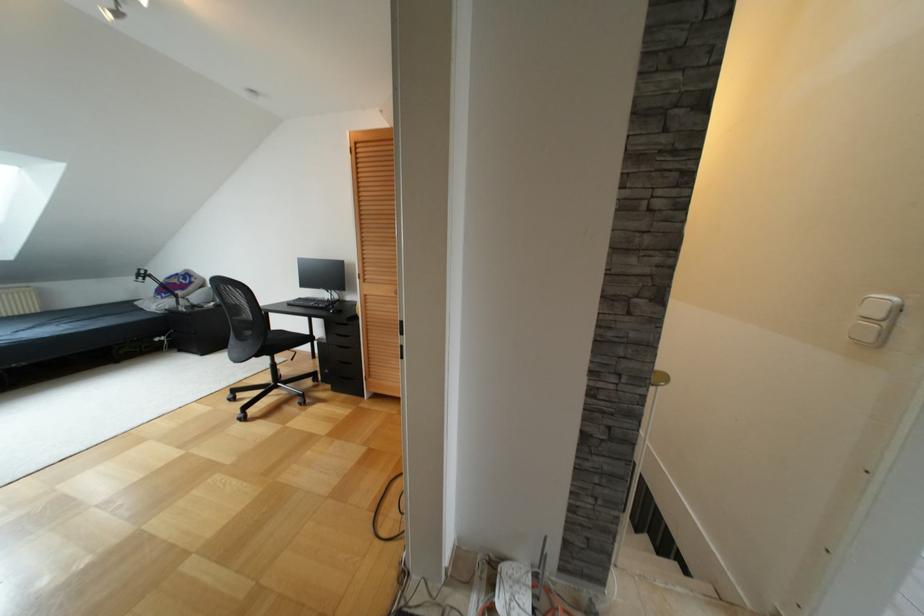
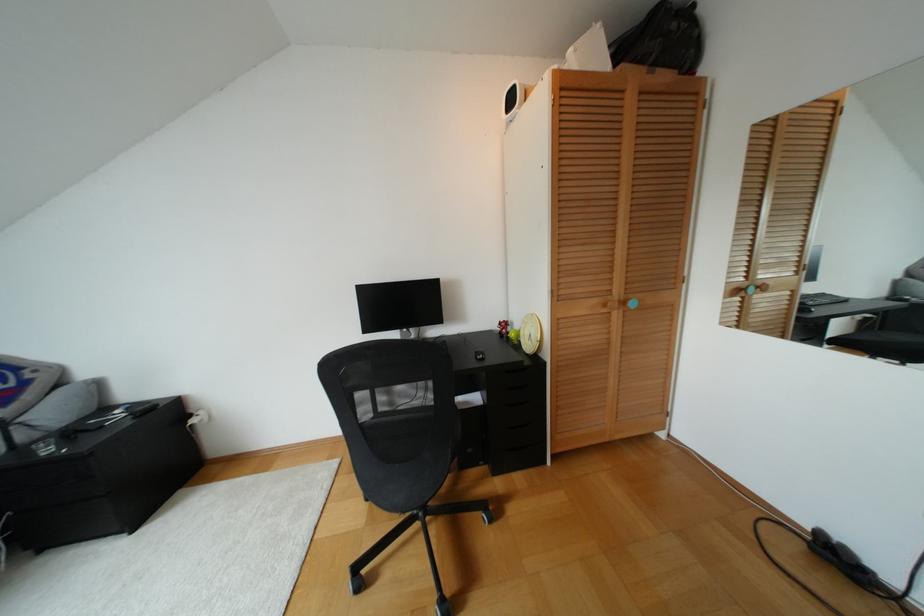
In the second image, find the point that corresponds to point (233, 399) in the first image.

(359, 585)